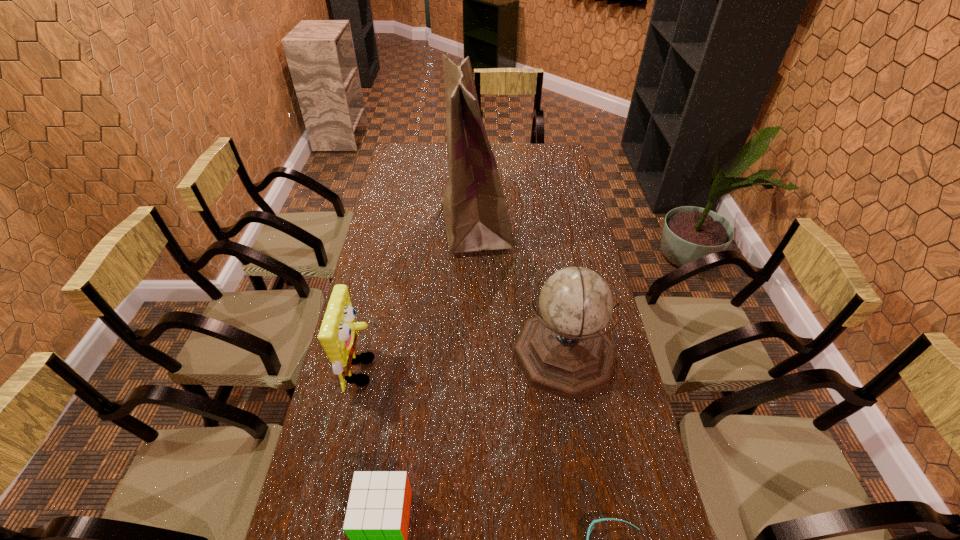
Choose which object is the nearest neighbor to the cube. Please provide its 2D coordinates. Your answer should be formatted as a tuple, i.e. [(x, y)], where the tuple contains the x and y coordinates of a point satisfying the conditions above.

[(338, 336)]